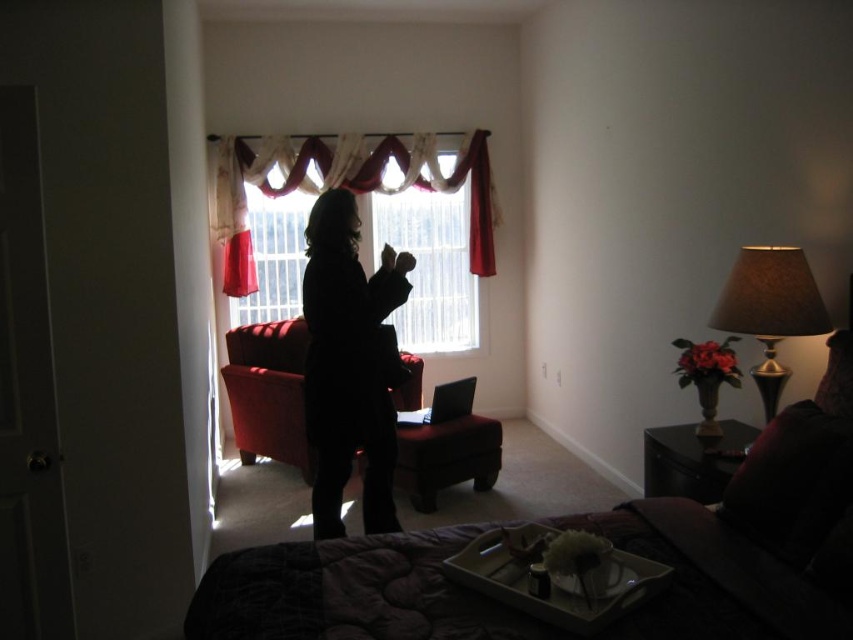
Question: Is dark fabric bed at center wider than velvet red armchair at center?

Choices:
 (A) yes
 (B) no

Answer: (A)

Question: Which point is closer to the camera?

Choices:
 (A) (500, 538)
 (B) (316, 172)
 (C) (746, 248)

Answer: (A)

Question: Which object is farther from the camera taking this photo?

Choices:
 (A) velvet red armchair at center
 (B) velvet-like red curtains at center

Answer: (B)

Question: Does black matte coat at center appear on the right side of velvet-like red curtains at center?

Choices:
 (A) no
 (B) yes

Answer: (B)

Question: Among these objects, which one is nearest to the camera?

Choices:
 (A) dark fabric bed at center
 (B) velvet-like red curtains at center
 (C) black matte coat at center

Answer: (A)

Question: Is dark fabric bed at center smaller than brown fabric lampshade at right?

Choices:
 (A) yes
 (B) no

Answer: (B)